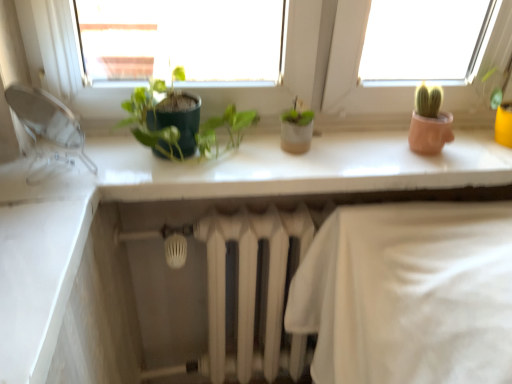
At what (x,y) coordinates should I click in order to perform the action: click on white glossy counter top at upper center. Please return your answer as a coordinate pair (x, y). The image size is (512, 384). Looking at the image, I should click on (271, 169).

Identify the location of transparent plastic faucet at left. (48, 130).

Are white glossy counter top at upper center and green matte plant at center far apart?

They are positioned close to each other.

Is green matte plant at center a part of white glossy counter top at upper center?

No, green matte plant at center is located outside of white glossy counter top at upper center.

From the picture: From the image's perspective, which is below, white glossy counter top at upper center or green matte plant at center?

white glossy counter top at upper center.

Is transparent plastic faucet at left located outside green matte plant at center?

Yes, transparent plastic faucet at left is outside of green matte plant at center.

Is transparent plastic faucet at left positioned far away from green matte plant at center?

transparent plastic faucet at left is actually quite close to green matte plant at center.

Is point (89, 170) positioned behind point (223, 120)?

No, (89, 170) is in front of (223, 120).

Looking at this image, who is shorter, transparent plastic faucet at left or green matte plant at center?

Standing shorter between the two is transparent plastic faucet at left.

Can white glossy counter top at upper center be found inside transparent plastic faucet at left?

No.

From the image's perspective, relative to white glossy counter top at upper center, is transparent plastic faucet at left above or below?

Clearly, from the image's perspective, transparent plastic faucet at left is above white glossy counter top at upper center.

Is transparent plastic faucet at left facing towards white glossy counter top at upper center?

No, transparent plastic faucet at left is not aimed at white glossy counter top at upper center.

Does transparent plastic faucet at left appear on the left side of white glossy counter top at upper center?

Yes, transparent plastic faucet at left is to the left of white glossy counter top at upper center.

Can you confirm if green matte plant at center is positioned to the right of white glossy counter top at upper center?

Incorrect, green matte plant at center is not on the right side of white glossy counter top at upper center.

Does green matte plant at center turn towards white glossy counter top at upper center?

No, green matte plant at center does not turn towards white glossy counter top at upper center.

Who is smaller, green matte plant at center or white glossy counter top at upper center?

Smaller between the two is green matte plant at center.

From the image's perspective, which is above, green matte plant at center or transparent plastic faucet at left?

green matte plant at center appears higher in the image.

Is green matte plant at center far away from transparent plastic faucet at left?

No, green matte plant at center is not far from transparent plastic faucet at left.

Considering the sizes of objects green matte plant at center and transparent plastic faucet at left in the image provided, who is taller, green matte plant at center or transparent plastic faucet at left?

green matte plant at center.

Considering the relative positions of white glossy counter top at upper center and transparent plastic faucet at left in the image provided, is white glossy counter top at upper center to the left or to the right of transparent plastic faucet at left?

From the image, it's evident that white glossy counter top at upper center is to the right of transparent plastic faucet at left.

Is white glossy counter top at upper center aimed at transparent plastic faucet at left?

No, white glossy counter top at upper center is not turned towards transparent plastic faucet at left.

From a real-world perspective, between white glossy counter top at upper center and transparent plastic faucet at left, who is vertically lower?

white glossy counter top at upper center.

This screenshot has width=512, height=384. I want to click on counter top behind the green matte plant at center, so click(271, 169).

You are a GUI agent. You are given a task and a screenshot of the screen. Output one action in this format:
    pyautogui.click(x=<x>, y=<y>)
    Task: Click on the faucet below the green matte plant at center (from a real-world perspective)
    This screenshot has height=384, width=512.
    Given the screenshot: What is the action you would take?
    pyautogui.click(x=48, y=130)

From the image, which object appears to be nearer to white glossy counter top at upper center, transparent plastic faucet at left or green matte plant at center?

green matte plant at center is closer to white glossy counter top at upper center.

Which object lies further to the anchor point green matte plant at center, transparent plastic faucet at left or white glossy counter top at upper center?

Based on the image, transparent plastic faucet at left appears to be further to green matte plant at center.

Looking at the image, which one is located further to transparent plastic faucet at left, white glossy counter top at upper center or green matte plant at center?

white glossy counter top at upper center is further to transparent plastic faucet at left.

Looking at the image, which one is located closer to transparent plastic faucet at left, green matte plant at center or white glossy counter top at upper center?

Among the two, green matte plant at center is located nearer to transparent plastic faucet at left.

Looking at the image, which one is located closer to green matte plant at center, white glossy counter top at upper center or transparent plastic faucet at left?

white glossy counter top at upper center is closer to green matte plant at center.

From the image, which object appears to be farther from white glossy counter top at upper center, green matte plant at center or transparent plastic faucet at left?

The object further to white glossy counter top at upper center is transparent plastic faucet at left.

Find the location of `houseplant between transparent plastic faucet at left and white glossy counter top at upper center in the horizontal direction`. houseplant between transparent plastic faucet at left and white glossy counter top at upper center in the horizontal direction is located at coordinates (179, 121).